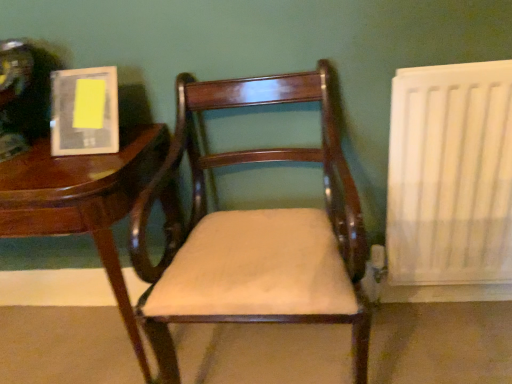
Question: Is point (52, 72) positioned closer to the camera than point (420, 180)?

Choices:
 (A) farther
 (B) closer

Answer: (B)

Question: Considering the relative positions of matte plastic book at upper left and white matte radiator at right in the image provided, is matte plastic book at upper left to the left or to the right of white matte radiator at right?

Choices:
 (A) left
 (B) right

Answer: (A)

Question: Estimate the real-world distances between objects in this image. Which object is farther from the matte wood chair at center?

Choices:
 (A) wooden table at left
 (B) matte plastic book at upper left
 (C) white matte radiator at right

Answer: (C)

Question: Which object is positioned farthest from the matte wood chair at center?

Choices:
 (A) white matte radiator at right
 (B) matte plastic book at upper left
 (C) wooden table at left

Answer: (A)